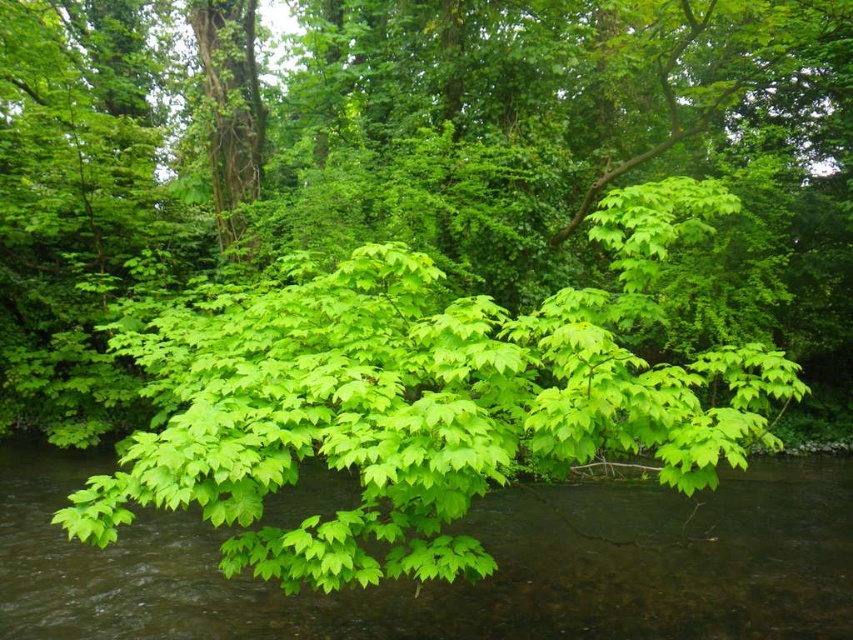
You are a park ranger planning to install a safety barrier between the green leafy tree at center and the green leafy branches at center. The barrier requires a minimum of 6 meters of space to be installed properly. Based on the scene, will the available space between them suffice for the barrier?

The distance between the green leafy tree at center and the green leafy branches at center is 5.75 meters, which is less than the required 6 meters. Therefore, the available space is insufficient for installing the barrier properly.

You are standing in the forest and want to take a photo of the green leafy tree at center. If your camera has a maximum focus range of 8 meters, will you need to adjust your position to capture it clearly?

The green leafy tree at center is 8.83 meters away from the camera, which exceeds the maximum focus range of 8 meters. You will need to move closer to ensure the tree is in focus.

You are a hiker trying to cross the stream in the forest. You notice the green leafy tree at center and the green leafy branches at center. Which one is closer to the stream?

The green leafy branches at center are closer to the stream because the green leafy tree at center is above them, meaning the branches are lower and nearer to the stream.